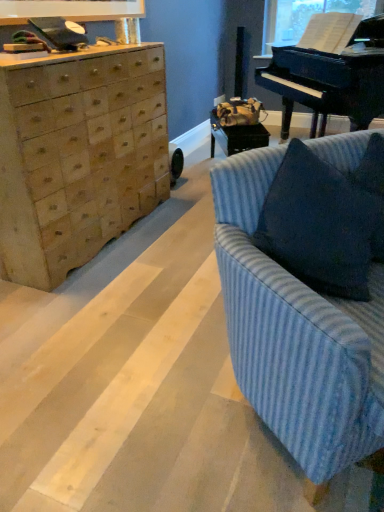
Identify the location of blue striped fabric couch at right. The width and height of the screenshot is (384, 512). (296, 334).

Where is `natural wood chest of drawers at left`? natural wood chest of drawers at left is located at coordinates (78, 158).

This screenshot has height=512, width=384. Describe the element at coordinates (305, 17) in the screenshot. I see `transparent plastic window screen at upper right` at that location.

Where is `blue textured pillow at right`? The image size is (384, 512). blue textured pillow at right is located at coordinates (325, 220).

This screenshot has width=384, height=512. I want to click on black polished piano at upper right, so click(330, 71).

Is black polished piano at upper right turned away from blue textured pillow at right?

No.

Is blue textured pillow at right completely or partially inside black polished piano at upper right?

No, black polished piano at upper right does not contain blue textured pillow at right.

Considering the relative positions of black polished piano at upper right and blue textured pillow at right in the image provided, is black polished piano at upper right to the right of blue textured pillow at right from the viewer's perspective?

Yes, black polished piano at upper right is to the right of blue textured pillow at right.

Relative to blue textured pillow at right, is black polished piano at upper right in front or behind?

In the image, black polished piano at upper right appears behind blue textured pillow at right.

Is transparent plastic window screen at upper right in contact with black polished piano at upper right?

No.

Does transparent plastic window screen at upper right appear on the left side of black polished piano at upper right?

Yes, transparent plastic window screen at upper right is to the left of black polished piano at upper right.

Considering the positions of point (287, 35) and point (324, 51), is point (287, 35) closer or farther from the camera than point (324, 51)?

Point (287, 35) appears to be farther away from the viewer than point (324, 51).

Is blue striped fabric couch at right located outside black polished piano at upper right?

Yes, blue striped fabric couch at right is located beyond the bounds of black polished piano at upper right.

Which object is wider, blue striped fabric couch at right or black polished piano at upper right?

black polished piano at upper right is wider.

From the image's perspective, who appears lower, blue striped fabric couch at right or black polished piano at upper right?

blue striped fabric couch at right is shown below in the image.

Is the position of blue striped fabric couch at right less distant than that of black polished piano at upper right?

Yes, blue striped fabric couch at right is in front of black polished piano at upper right.

What's the angular difference between natural wood chest of drawers at left and transparent plastic window screen at upper right's facing directions?

They differ by 145 degrees in their facing directions.

Is natural wood chest of drawers at left turned away from transparent plastic window screen at upper right?

No, natural wood chest of drawers at left's orientation is not away from transparent plastic window screen at upper right.

Which of these two, natural wood chest of drawers at left or transparent plastic window screen at upper right, stands taller?

natural wood chest of drawers at left is taller.

Does point (126, 88) come in front of point (328, 0)?

Yes, point (126, 88) is in front of point (328, 0).

From a real-world perspective, which object stands above the other?

From a 3D spatial view, transparent plastic window screen at upper right is above.

Where is `studio couch in front of the transparent plastic window screen at upper right`? studio couch in front of the transparent plastic window screen at upper right is located at coordinates (296, 334).

From the image's perspective, is transparent plastic window screen at upper right beneath blue striped fabric couch at right?

No.

How different are the orientations of blue striped fabric couch at right and blue textured pillow at right in degrees?

The angular difference between blue striped fabric couch at right and blue textured pillow at right is 3.22 degrees.

Identify the location of pillow on the left of blue striped fabric couch at right. (325, 220).

Is point (323, 358) positioned in front of point (365, 257)?

Yes, it is in front of point (365, 257).

From a real-world perspective, is blue striped fabric couch at right positioned under blue textured pillow at right based on gravity?

Correct, in the physical world, blue striped fabric couch at right is lower than blue textured pillow at right.

From the image's perspective, is blue textured pillow at right over natural wood chest of drawers at left?

Incorrect, from the image's perspective, blue textured pillow at right is lower than natural wood chest of drawers at left.

Are blue textured pillow at right and natural wood chest of drawers at left making contact?

blue textured pillow at right and natural wood chest of drawers at left are clearly separated.

From a real-world perspective, is blue textured pillow at right on natural wood chest of drawers at left?

Yes, from a real-world perspective, blue textured pillow at right is on top of natural wood chest of drawers at left.

Which is more to the right, blue textured pillow at right or natural wood chest of drawers at left?

Positioned to the right is blue textured pillow at right.

At what (x,y) coordinates should I click in order to perform the action: click on pillow in front of the black polished piano at upper right. Please return your answer as a coordinate pair (x, y). Image resolution: width=384 pixels, height=512 pixels. Looking at the image, I should click on (325, 220).

There is a black polished piano at upper right. In order to click on window screen above it (from a real-world perspective) in this screenshot , I will do (305, 17).

Based on their spatial positions, is blue textured pillow at right or transparent plastic window screen at upper right closer to black polished piano at upper right?

transparent plastic window screen at upper right is closer to black polished piano at upper right.

Estimate the real-world distances between objects in this image. Which object is closer to black polished piano at upper right, transparent plastic window screen at upper right or blue textured pillow at right?

The object closer to black polished piano at upper right is transparent plastic window screen at upper right.

From the image, which object appears to be nearer to blue striped fabric couch at right, transparent plastic window screen at upper right or blue textured pillow at right?

blue textured pillow at right is positioned closer to the anchor blue striped fabric couch at right.

Based on their spatial positions, is blue textured pillow at right or blue striped fabric couch at right further from natural wood chest of drawers at left?

Based on the image, blue textured pillow at right appears to be further to natural wood chest of drawers at left.

Considering their positions, is blue striped fabric couch at right positioned further to black polished piano at upper right than transparent plastic window screen at upper right?

Among the two, blue striped fabric couch at right is located further to black polished piano at upper right.

Looking at the image, which one is located closer to blue textured pillow at right, natural wood chest of drawers at left or black polished piano at upper right?

natural wood chest of drawers at left is positioned closer to the anchor blue textured pillow at right.

When comparing their distances from transparent plastic window screen at upper right, does blue striped fabric couch at right or black polished piano at upper right seem further?

blue striped fabric couch at right is positioned further to the anchor transparent plastic window screen at upper right.

Which object lies further to the anchor point blue textured pillow at right, blue striped fabric couch at right or transparent plastic window screen at upper right?

The object further to blue textured pillow at right is transparent plastic window screen at upper right.

Where is `pillow between blue striped fabric couch at right and black polished piano at upper right in the front-back direction`? This screenshot has height=512, width=384. pillow between blue striped fabric couch at right and black polished piano at upper right in the front-back direction is located at coordinates (325, 220).

In order to click on piano positioned between blue textured pillow at right and transparent plastic window screen at upper right from near to far in this screenshot , I will do `click(330, 71)`.

Find the location of `studio couch between natural wood chest of drawers at left and black polished piano at upper right from left to right`. studio couch between natural wood chest of drawers at left and black polished piano at upper right from left to right is located at coordinates (296, 334).

At what (x,y) coordinates should I click in order to perform the action: click on pillow situated between natural wood chest of drawers at left and black polished piano at upper right from left to right. Please return your answer as a coordinate pair (x, y). The height and width of the screenshot is (512, 384). Looking at the image, I should click on (325, 220).